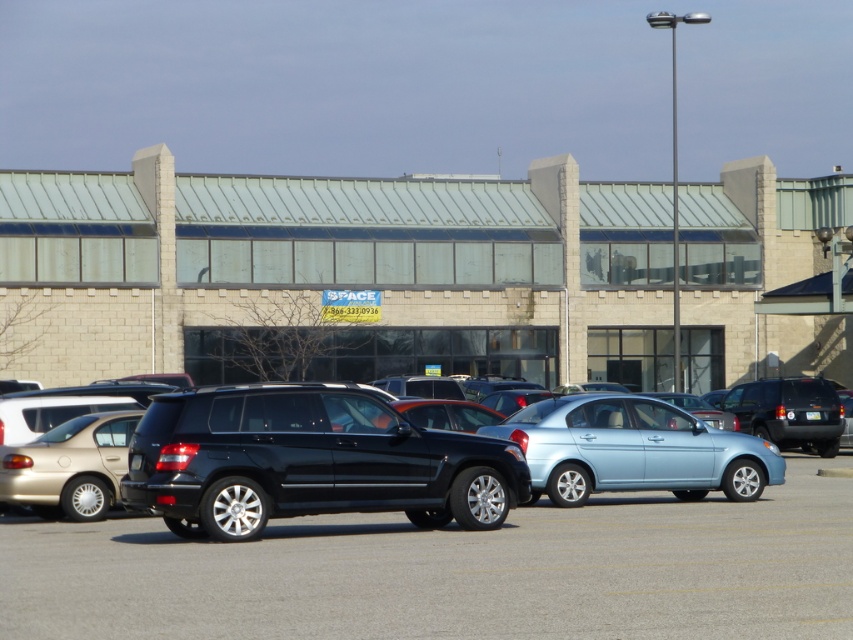
Who is lower down, glossy black suv at center or light blue metallic sedan at center?

light blue metallic sedan at center

Between glossy black suv at center and light blue metallic sedan at center, which one is positioned higher?

glossy black suv at center is higher up.

What do you see at coordinates (309, 461) in the screenshot? I see `glossy black suv at center` at bounding box center [309, 461].

At what (x,y) coordinates should I click in order to perform the action: click on glossy black suv at center. Please return your answer as a coordinate pair (x, y). This screenshot has height=640, width=853. Looking at the image, I should click on (309, 461).

The width and height of the screenshot is (853, 640). Describe the element at coordinates (407, 458) in the screenshot. I see `shiny black suv at center` at that location.

Can you confirm if shiny black suv at center is positioned to the right of light blue metallic sedan at center?

Correct, you'll find shiny black suv at center to the right of light blue metallic sedan at center.

Which is in front, point (704, 428) or point (781, 476)?

Point (704, 428)

I want to click on shiny black suv at center, so click(x=407, y=458).

Is point (189, 417) closer to viewer compared to point (164, 403)?

Yes.

Does shiny black suv at center have a lesser width compared to glossy black suv at center?

No, shiny black suv at center is not thinner than glossy black suv at center.

Does point (315, 484) lie behind point (184, 477)?

Yes, point (315, 484) is farther from viewer.

The width and height of the screenshot is (853, 640). In order to click on shiny black suv at center in this screenshot , I will do `click(407, 458)`.